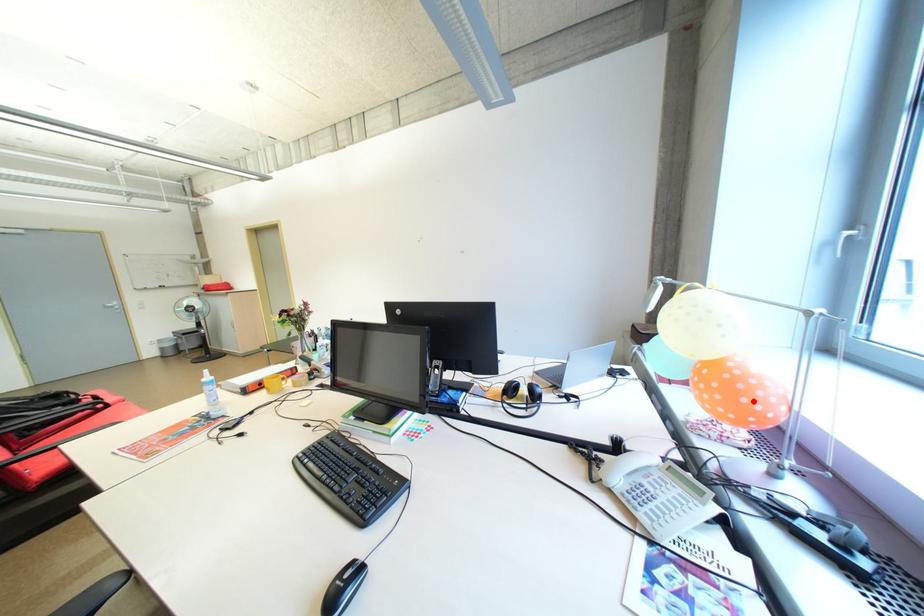
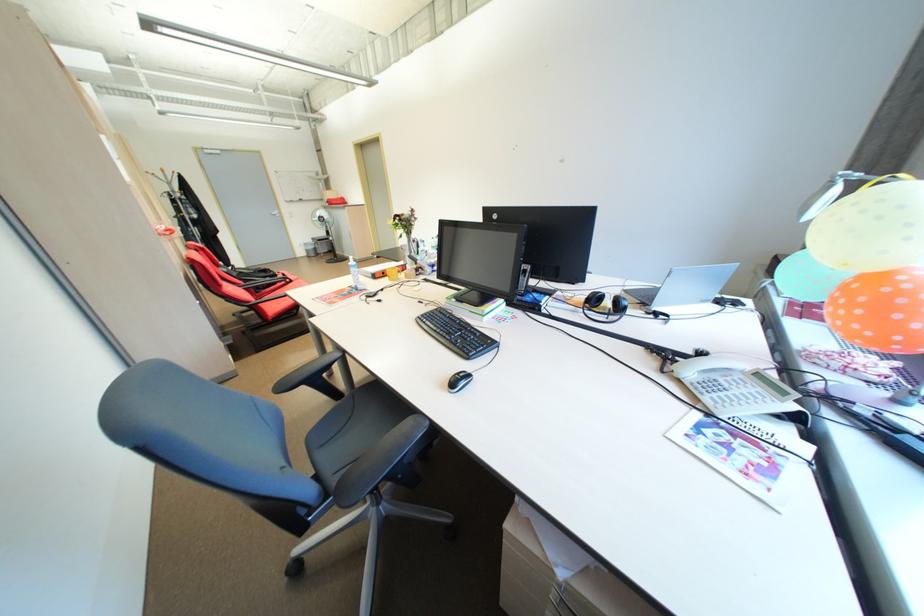
Locate, in the second image, the point that corresponds to the highlighted location in the first image.

(906, 317)